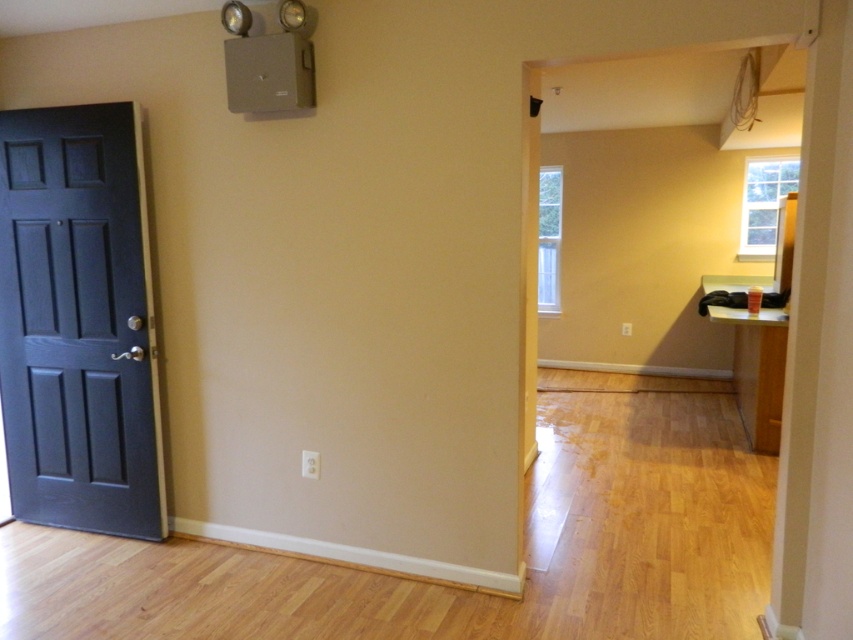
From the picture: You are moving a large piece of furniture that is 1.2 meters wide. You need to pass through the doorway shown in the image. Considering the matte black door at left and the light brown wood table at right, which object might block the passage of your furniture and why?

The light brown wood table at right might block the passage because the matte black door at left has a smaller size compared to the table, meaning the doorway may not be wide enough for the 1.2 meter wide furniture to pass through.

You are moving a large painting that is 1.2 meters wide. You want to move it through the doorway in the center of the image. Can you pass the painting through the doorway without tilting it sideways? The matte black door at left and the light brown wood table at right are in your path. Which object will you encounter first while moving towards the doorway?

The matte black door at left is to the left of the light brown wood table at right, so you will encounter the matte black door at left first. Since the painting is 1.2 meters wide, you need to ensure the doorway is wider than 1.2 meters. However, the provided information does not specify the doorway width, so we cannot confirm if the painting will fit.